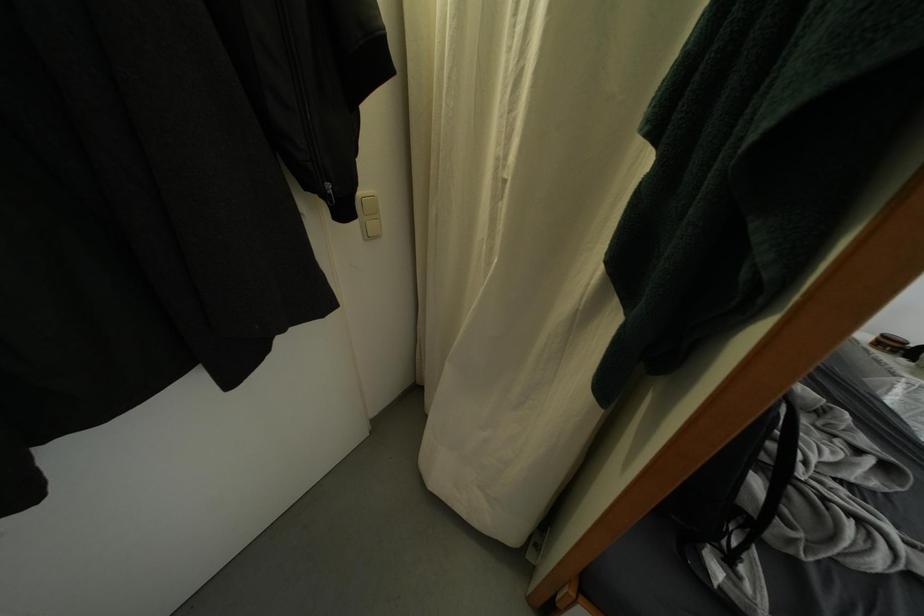
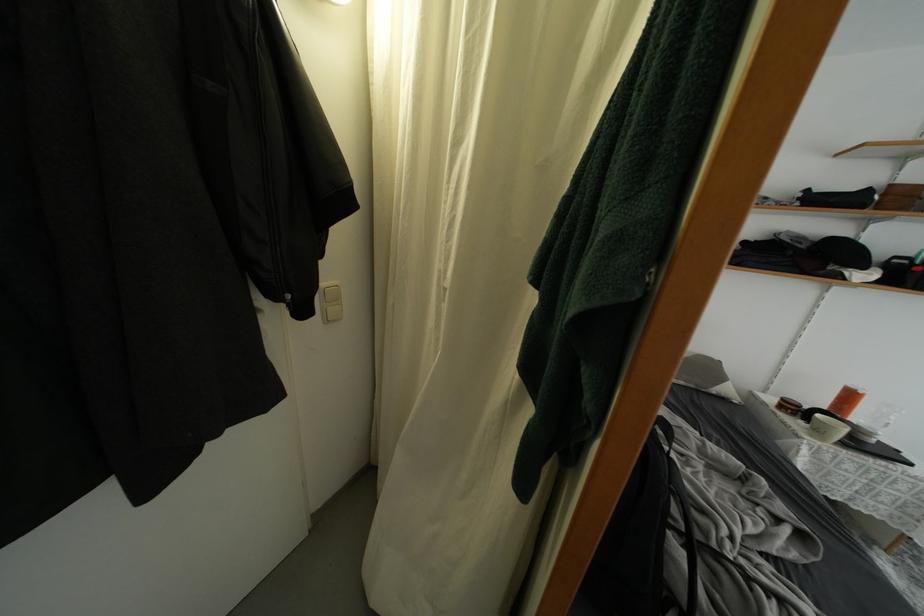
In the second image, find the point that corresponds to point (484, 302) in the first image.

(432, 387)